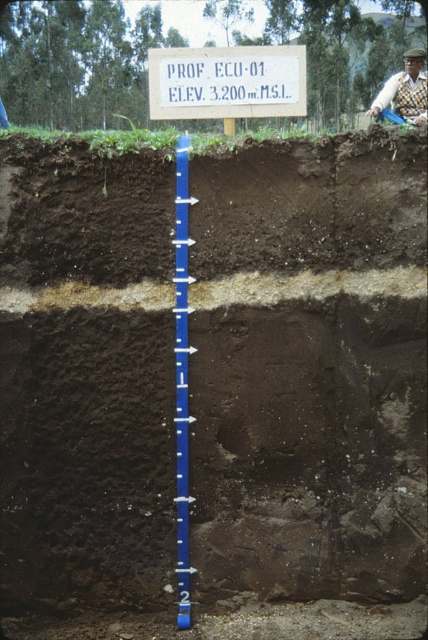
Is dark brown soil at center positioned behind white plastic sign at upper center?

No, dark brown soil at center is closer to the viewer.

Does dark brown soil at center have a larger size compared to white plastic sign at upper center?

Correct, dark brown soil at center is larger in size than white plastic sign at upper center.

What do you see at coordinates (309, 202) in the screenshot? Image resolution: width=428 pixels, height=640 pixels. I see `dark brown soil at center` at bounding box center [309, 202].

I want to click on dark brown soil at center, so click(309, 202).

Between white plastic sign at upper center and blue plastic ruler at center, which one appears on the left side from the viewer's perspective?

From the viewer's perspective, blue plastic ruler at center appears more on the left side.

Which is behind, point (249, 48) or point (178, 625)?

The point (249, 48) is behind.

Where is `white plastic sign at upper center`? This screenshot has width=428, height=640. white plastic sign at upper center is located at coordinates (226, 81).

Does white plastic sign at upper center have a larger size compared to knitted sweater at upper right?

No, white plastic sign at upper center is not bigger than knitted sweater at upper right.

Is white plastic sign at upper center above knitted sweater at upper right?

No.

Describe the element at coordinates (226, 81) in the screenshot. I see `white plastic sign at upper center` at that location.

Locate an element on the screen. white plastic sign at upper center is located at coordinates (226, 81).